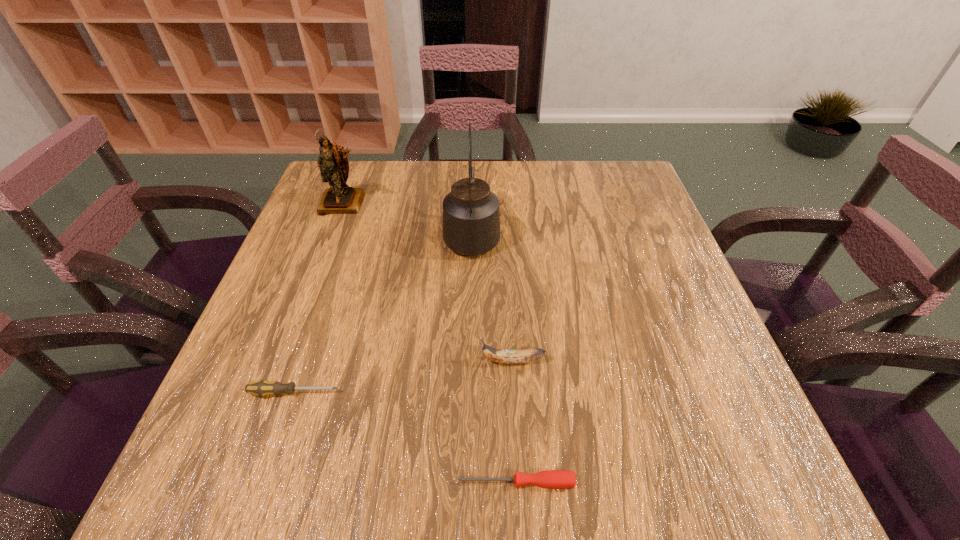
The height and width of the screenshot is (540, 960). Identify the location of vacant space at the near right corner of the desktop. (703, 461).

What are the coordinates of `vacant area that lies between the taller screwdriver and the kettle` in the screenshot? It's located at (383, 314).

This screenshot has height=540, width=960. I want to click on empty space between the taller screwdriver and the third nearest object, so pos(403,377).

Where is `vacant space that is in between the third farthest object and the shortest object`? vacant space that is in between the third farthest object and the shortest object is located at coordinates (515, 422).

Where is `unoccupied position between the farther screwdriver and the figurine`? Image resolution: width=960 pixels, height=540 pixels. unoccupied position between the farther screwdriver and the figurine is located at coordinates (319, 298).

Identify the location of free space between the shorter screwdriver and the figurine. (430, 342).

Where is `unoccupied position between the banana and the figurine`? This screenshot has height=540, width=960. unoccupied position between the banana and the figurine is located at coordinates click(x=428, y=282).

Locate an element on the screen. Image resolution: width=960 pixels, height=540 pixels. empty location between the third nearest object and the tallest object is located at coordinates (492, 298).

Locate an element on the screen. free space between the figurine and the nearest object is located at coordinates (430, 342).

Locate which object is the fourth closest to the banana. Please provide its 2D coordinates. Your answer should be formatted as a tuple, i.e. [(x, y)], where the tuple contains the x and y coordinates of a point satisfying the conditions above.

[(334, 167)]